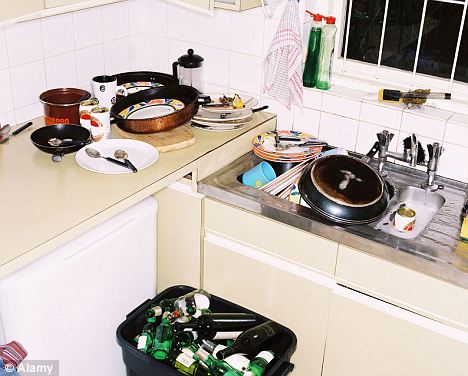
I want to click on french press, so coord(189,82).